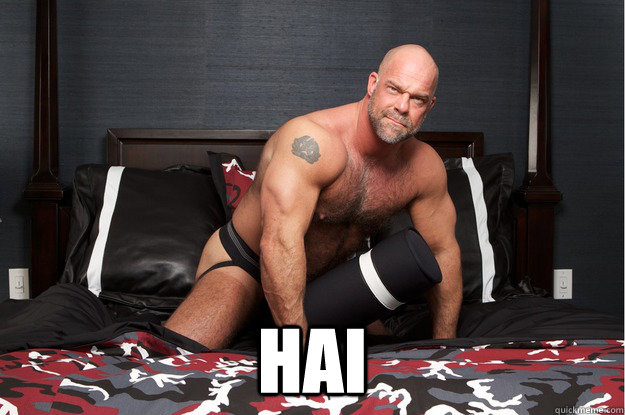
Locate an element on the screen. Image resolution: width=625 pixels, height=415 pixels. cushion is located at coordinates (180, 259).